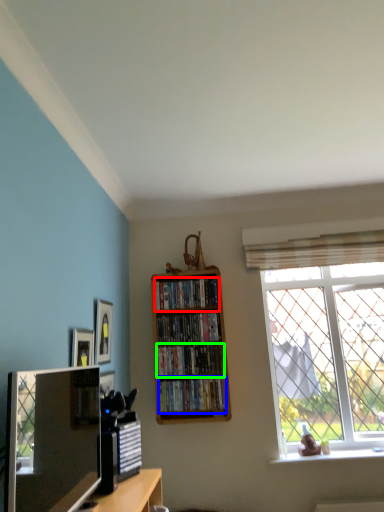
Question: Estimate the real-world distances between objects in this image. Which object is closer to book (highlighted by a red box), book (highlighted by a blue box) or book (highlighted by a green box)?

Choices:
 (A) book
 (B) book

Answer: (B)